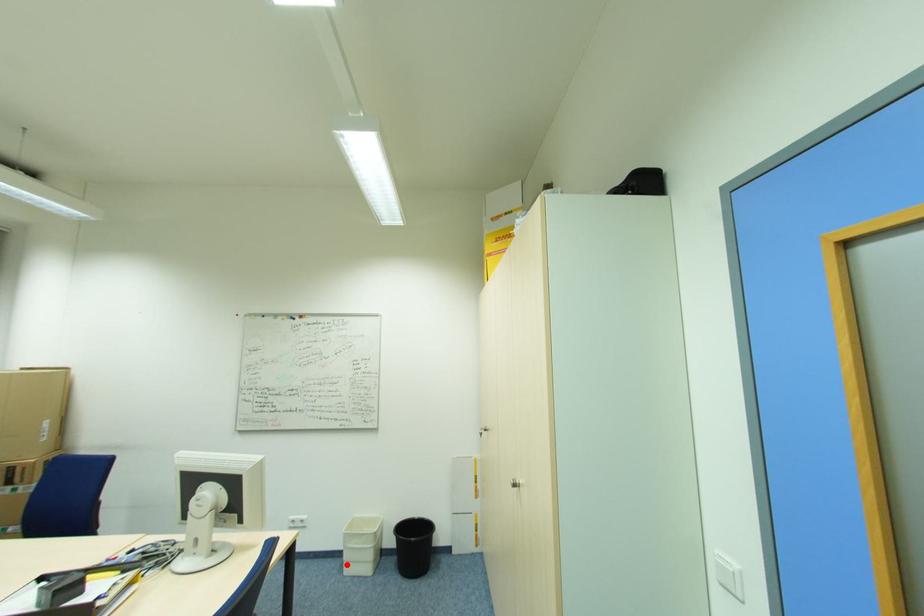
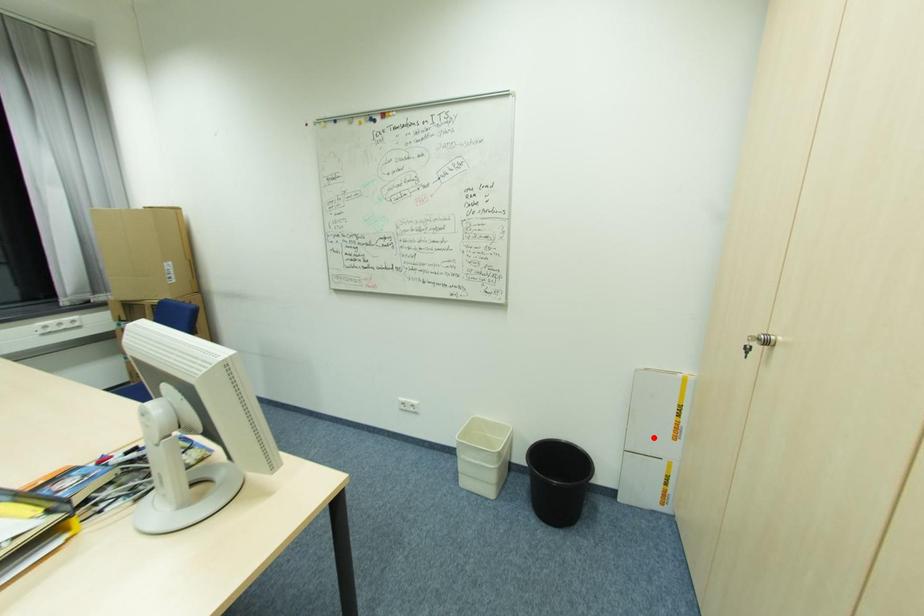
I am providing you with two images of the same scene from different viewpoints. A red point is marked on the first image and another point is marked on the second image. Are the points marked in image1 and image2 representing the same 3D position?

No